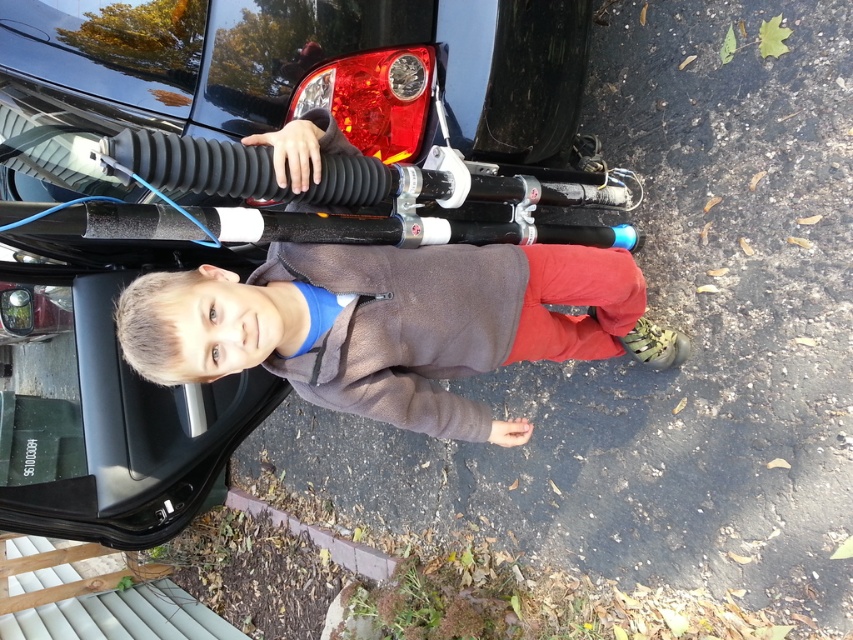
Is point (532, 65) more distant than point (521, 156)?

No.

Is glossy black car at upper left further to the viewer compared to black rubber tire at upper center?

No, it is in front of black rubber tire at upper center.

Is point (26, 13) more distant than point (508, 84)?

No, (26, 13) is in front of (508, 84).

Image resolution: width=853 pixels, height=640 pixels. I want to click on glossy black car at upper left, so click(x=276, y=72).

Can you confirm if glossy black car at upper left is positioned below brown fleece jacket at center?

No, glossy black car at upper left is not below brown fleece jacket at center.

Which is below, glossy black car at upper left or brown fleece jacket at center?

brown fleece jacket at center

Who is more distant from viewer, (61,490) or (634,321)?

The point (634,321) is more distant.

Find the location of a particular element. Image resolution: width=853 pixels, height=640 pixels. glossy black car at upper left is located at coordinates (276, 72).

Between brown fleece jacket at center and black rubber tire at upper center, which one appears on the right side from the viewer's perspective?

From the viewer's perspective, black rubber tire at upper center appears more on the right side.

Is brown fleece jacket at center positioned in front of black rubber tire at upper center?

Yes.

Which is in front, point (248, 308) or point (578, 16)?

Point (248, 308) is more forward.

Where is `brown fleece jacket at center`? brown fleece jacket at center is located at coordinates (392, 324).